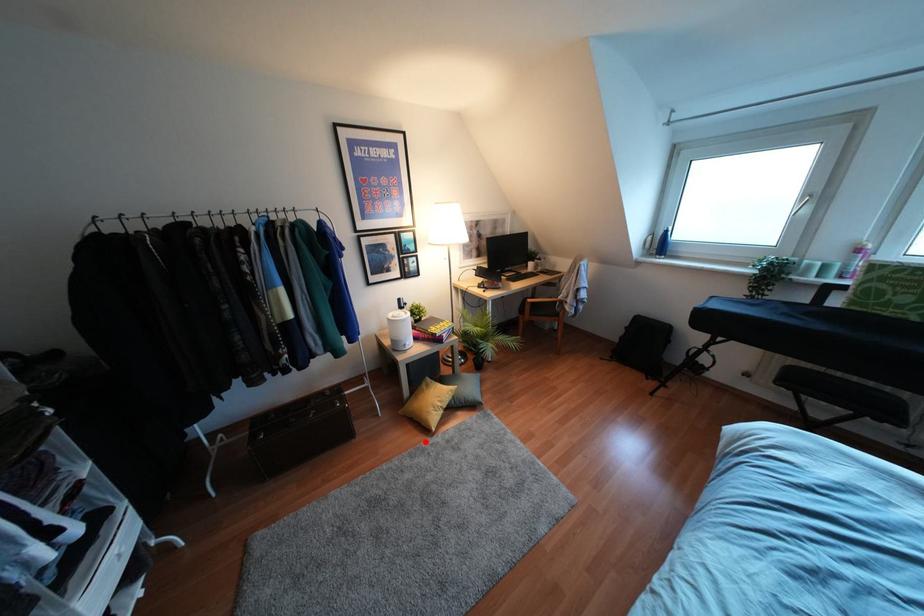
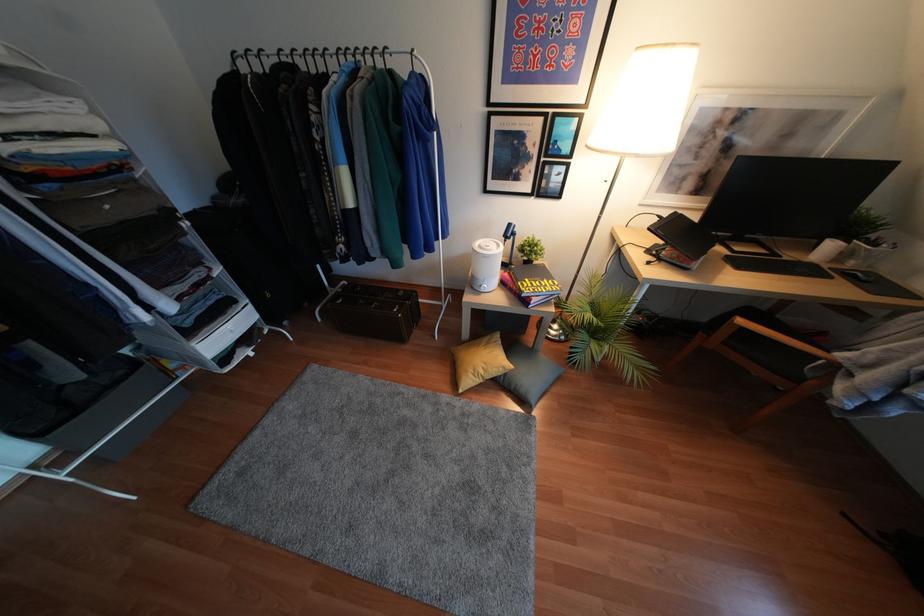
The point at the highlighted location is marked in the first image. Where is the corresponding point in the second image?

(445, 397)